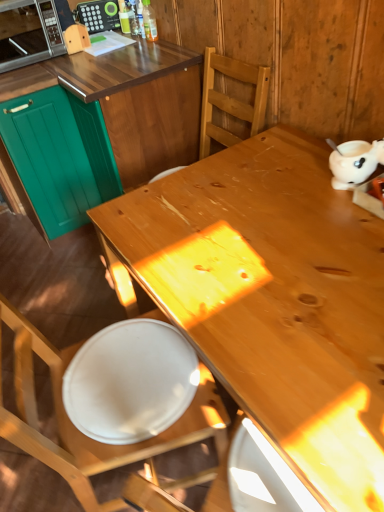
Question: Can you confirm if white glossy plate at lower left is positioned to the left of wooden chair at center?

Choices:
 (A) yes
 (B) no

Answer: (B)

Question: Is white glossy plate at lower left positioned with its back to wooden chair at center?

Choices:
 (A) yes
 (B) no

Answer: (A)

Question: Could you tell me if white glossy plate at lower left is facing wooden chair at center?

Choices:
 (A) no
 (B) yes

Answer: (B)

Question: From a real-world perspective, is white glossy plate at lower left over wooden chair at center?

Choices:
 (A) yes
 (B) no

Answer: (A)

Question: From the image's perspective, would you say white glossy plate at lower left is positioned over wooden chair at center?

Choices:
 (A) yes
 (B) no

Answer: (A)

Question: Considering the relative sizes of white glossy plate at lower left and wooden chair at center in the image provided, is white glossy plate at lower left bigger than wooden chair at center?

Choices:
 (A) yes
 (B) no

Answer: (B)

Question: Considering the relative positions of translucent plastic bottle at upper center and teal matte cabinet at left, the first cabinetry positioned from the left, in the image provided, is translucent plastic bottle at upper center to the right of teal matte cabinet at left, the first cabinetry positioned from the left, from the viewer's perspective?

Choices:
 (A) yes
 (B) no

Answer: (A)

Question: Is translucent plastic bottle at upper center in front of teal matte cabinet at left, the second cabinetry viewed from the right?

Choices:
 (A) yes
 (B) no

Answer: (B)

Question: Does translucent plastic bottle at upper center appear on the left side of teal matte cabinet at left, the second cabinetry viewed from the right?

Choices:
 (A) yes
 (B) no

Answer: (B)

Question: Can you confirm if translucent plastic bottle at upper center is bigger than teal matte cabinet at left, the first cabinetry positioned from the left?

Choices:
 (A) no
 (B) yes

Answer: (A)

Question: From the image's perspective, is translucent plastic bottle at upper center above teal matte cabinet at left, the second cabinetry viewed from the right?

Choices:
 (A) no
 (B) yes

Answer: (B)

Question: Is there a large distance between translucent plastic bottle at upper center and teal matte cabinet at left, the first cabinetry positioned from the left?

Choices:
 (A) yes
 (B) no

Answer: (B)

Question: Considering the relative positions of natural wood desk at center and wooden chair at center in the image provided, is natural wood desk at center to the left of wooden chair at center from the viewer's perspective?

Choices:
 (A) yes
 (B) no

Answer: (B)